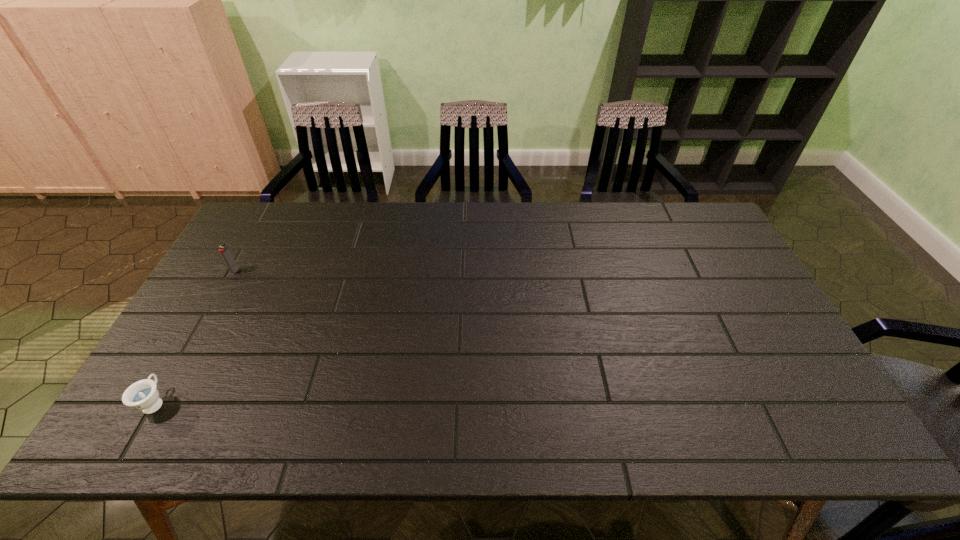
This screenshot has width=960, height=540. Find the location of `teacup situated at the left edge`. teacup situated at the left edge is located at coordinates (143, 395).

Find the location of `object that is at the near left corner`. object that is at the near left corner is located at coordinates (143, 395).

You are a GUI agent. You are given a task and a screenshot of the screen. Output one action in this format:
    pyautogui.click(x=<x>, y=<y>)
    Task: Click on the free space at the far edge of the desktop
    This screenshot has height=540, width=960.
    Given the screenshot: What is the action you would take?
    pyautogui.click(x=564, y=228)

The image size is (960, 540). Find the location of `vacant area at the near edge of the desktop`. vacant area at the near edge of the desktop is located at coordinates (731, 411).

Where is `vacant space at the left edge of the desktop`? The height and width of the screenshot is (540, 960). vacant space at the left edge of the desktop is located at coordinates (194, 332).

You are a GUI agent. You are given a task and a screenshot of the screen. Output one action in this format:
    pyautogui.click(x=<x>, y=<y>)
    Task: Click on the free region at the far right corner of the desktop
    Image resolution: width=960 pixels, height=540 pixels.
    Given the screenshot: What is the action you would take?
    pyautogui.click(x=691, y=241)

Where is `vacant space that satisfies the following two spatial constraints: 1. on the side of the taller object with the handle; 2. on the left side of the shorter object`? Image resolution: width=960 pixels, height=540 pixels. vacant space that satisfies the following two spatial constraints: 1. on the side of the taller object with the handle; 2. on the left side of the shorter object is located at coordinates (230, 271).

The width and height of the screenshot is (960, 540). Find the location of `vacant region that satisfies the following two spatial constraints: 1. on the side of the farther object with the handle; 2. on the left side of the nearer object`. vacant region that satisfies the following two spatial constraints: 1. on the side of the farther object with the handle; 2. on the left side of the nearer object is located at coordinates (230, 271).

Find the location of a particular element. The height and width of the screenshot is (540, 960). vacant region that satisfies the following two spatial constraints: 1. on the side of the teacup with the handle; 2. on the left side of the igniter is located at coordinates (230, 271).

This screenshot has height=540, width=960. I want to click on free space that satisfies the following two spatial constraints: 1. on the side of the farther object with the handle; 2. on the left side of the teacup, so click(x=230, y=271).